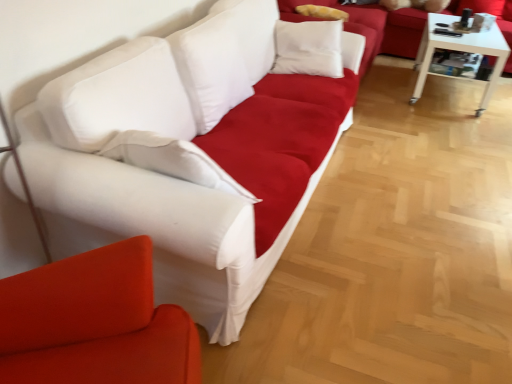
Question: Considering the positions of white fabric studio couch at upper center, which appears as the 3th studio couch when viewed from the front, and white fabric couch at left, which is the third studio couch from back to front, in the image, is white fabric studio couch at upper center, which appears as the 3th studio couch when viewed from the front, wider or thinner than white fabric couch at left, which is the third studio couch from back to front,?

Choices:
 (A) thin
 (B) wide

Answer: (B)

Question: Is white fabric studio couch at upper center, which appears as the 3th studio couch when viewed from the front, inside or outside of white fabric couch at left, the 1th studio couch positioned from the front?

Choices:
 (A) inside
 (B) outside

Answer: (B)

Question: Estimate the real-world distances between objects in this image. Which object is closer to the matte white couch at upper center?

Choices:
 (A) white fabric couch at left, which is the third studio couch from back to front
 (B) white fabric couch at center, the second studio couch when ordered from back to front
 (C) white fabric studio couch at upper center, which appears as the 3th studio couch when viewed from the front
 (D) white glossy table at right

Answer: (D)

Question: Estimate the real-world distances between objects in this image. Which object is closer to the white fabric couch at left, which is the third studio couch from back to front?

Choices:
 (A) white fabric studio couch at upper center, which appears as the 3th studio couch when viewed from the front
 (B) matte white couch at upper center
 (C) white fabric couch at center, positioned as the second studio couch in front-to-back order
 (D) white glossy table at right

Answer: (C)